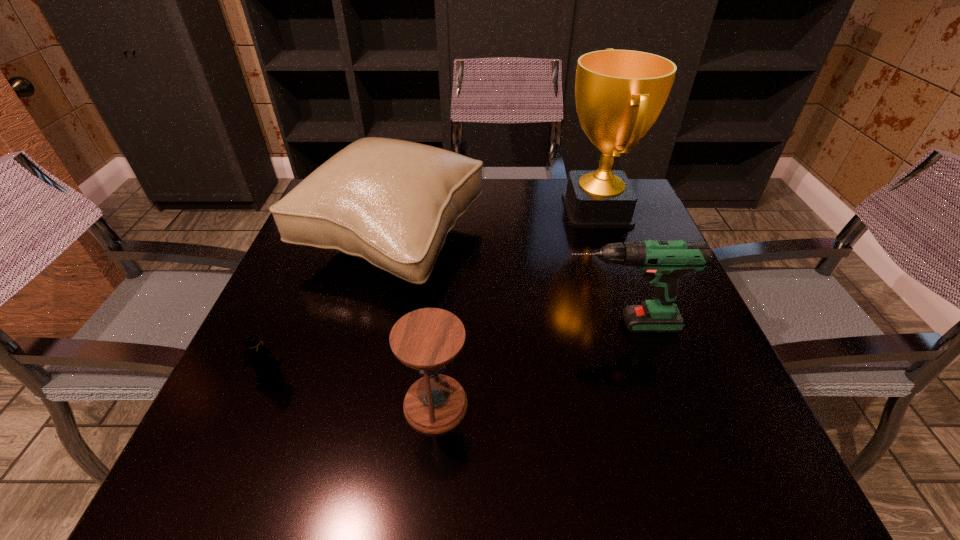
This screenshot has width=960, height=540. In order to click on unoccupied position between the tallest object and the third nearest object in this screenshot , I will do [x=608, y=267].

Identify the location of free spot between the tallest object and the drill. (608, 267).

Find the location of a particular element. This screenshot has width=960, height=540. vacant area that lies between the cushion and the Lego is located at coordinates (331, 308).

Where is `vacant area that lies between the drill and the tallest object`? The height and width of the screenshot is (540, 960). vacant area that lies between the drill and the tallest object is located at coordinates (608, 267).

This screenshot has width=960, height=540. In order to click on unoccupied area between the fourth tallest object and the award in this screenshot , I will do `click(516, 307)`.

At what (x,y) coordinates should I click in order to perform the action: click on object that stands as the second closest to the hourglass. Please return your answer as a coordinate pair (x, y). Looking at the image, I should click on (662, 262).

This screenshot has height=540, width=960. In order to click on object that can be found as the closest to the third farthest object in this screenshot , I will do `click(391, 202)`.

Image resolution: width=960 pixels, height=540 pixels. Identify the location of blank space that satisfies the following two spatial constraints: 1. on the handle side of the third nearest object; 2. on the face of the shortest object. (635, 376).

This screenshot has height=540, width=960. In order to click on vacant space that satisfies the following two spatial constraints: 1. on the front-facing side of the tallest object; 2. on the face of the Lego in this screenshot , I will do `click(656, 376)`.

Identify the location of free space that satisfies the following two spatial constraints: 1. on the front-facing side of the tallest object; 2. on the face of the shortest object. Image resolution: width=960 pixels, height=540 pixels. (656, 376).